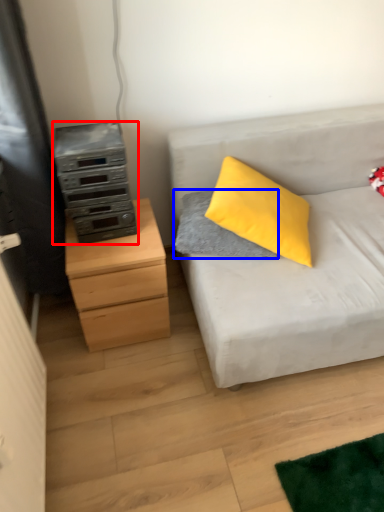
Question: Which object is further to the camera taking this photo, appliance (highlighted by a red box) or gray (highlighted by a blue box)?

Choices:
 (A) appliance
 (B) gray

Answer: (B)